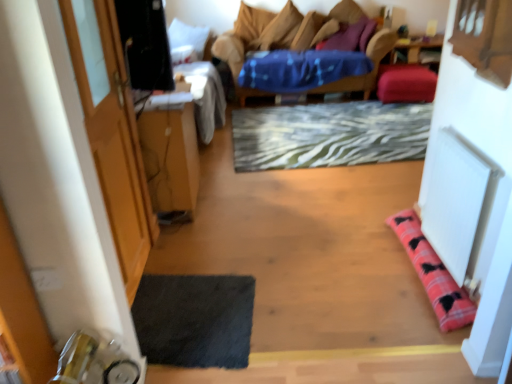
Image resolution: width=512 pixels, height=384 pixels. Find the location of `free space to the back side of pink plaid pillow at lower right, which is counted as the first pillow, starting from the front`. free space to the back side of pink plaid pillow at lower right, which is counted as the first pillow, starting from the front is located at coordinates (369, 213).